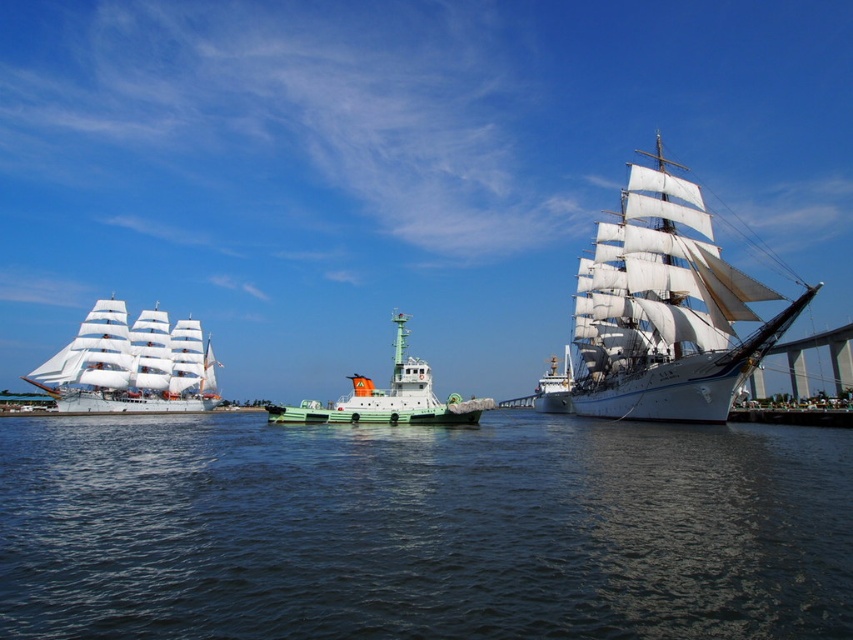
Can you confirm if white wooden sailboat at right is positioned to the right of green matte tugboat at center?

Yes, white wooden sailboat at right is to the right of green matte tugboat at center.

Between white wooden sailboat at right and green matte tugboat at center, which one is positioned lower?

green matte tugboat at center is below.

Who is more distant from viewer, (722, 376) or (347, 417)?

Positioned behind is point (347, 417).

Locate an element on the screen. white wooden sailboat at right is located at coordinates (665, 310).

Is dark blue water at center thinner than white sailboat at left?

In fact, dark blue water at center might be wider than white sailboat at left.

Does dark blue water at center have a larger size compared to white sailboat at left?

Indeed, dark blue water at center has a larger size compared to white sailboat at left.

At what (x,y) coordinates should I click in order to perform the action: click on dark blue water at center. Please return your answer as a coordinate pair (x, y). The image size is (853, 640). Looking at the image, I should click on (422, 529).

Does white wooden sailboat at right have a smaller size compared to white sailboat at left?

No.

Is point (630, 336) farther from viewer compared to point (82, 406)?

No, it is not.

This screenshot has height=640, width=853. What do you see at coordinates (665, 310) in the screenshot? I see `white wooden sailboat at right` at bounding box center [665, 310].

This screenshot has width=853, height=640. Identify the location of white wooden sailboat at right. (665, 310).